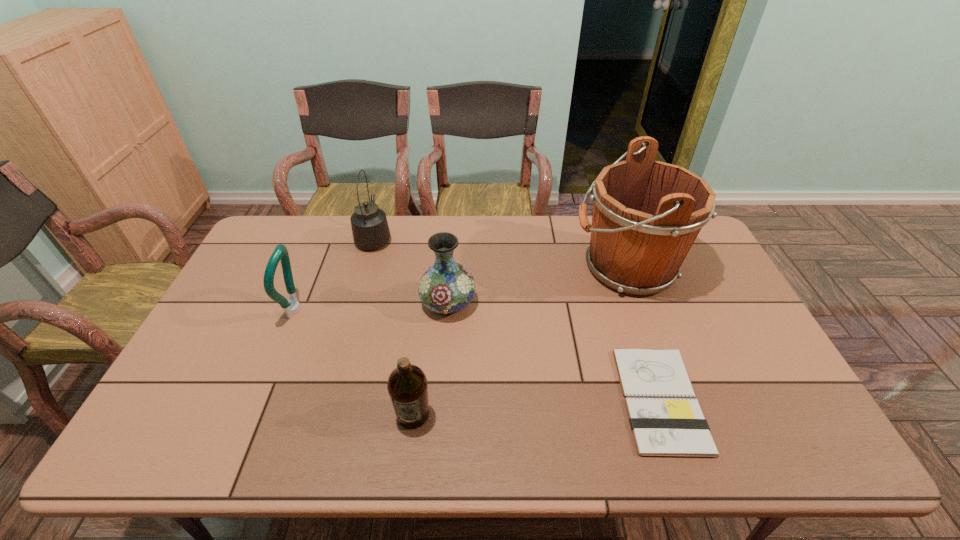
Image resolution: width=960 pixels, height=540 pixels. Find the location of `bucket`. bucket is located at coordinates (647, 214).

Identify the location of the fifth object from right to left. (370, 229).

I want to click on vase, so click(x=446, y=287).

At what (x,y) coordinates should I click in order to perform the action: click on bottle opener. Please return your answer as a coordinate pair (x, y). This screenshot has width=960, height=540. Looking at the image, I should click on click(x=292, y=306).

Find the location of `olive oil`. olive oil is located at coordinates (407, 385).

The height and width of the screenshot is (540, 960). I want to click on the shortest object, so click(x=663, y=423).

Where is `blank area located 0.220m with the handle on the side of the tallest object`? blank area located 0.220m with the handle on the side of the tallest object is located at coordinates (504, 268).

I want to click on blank space located with the handle on the side of the tallest object, so click(x=474, y=268).

Locate an element on the screen. Image resolution: width=960 pixels, height=540 pixels. vacant space located 0.100m with the handle on the side of the tallest object is located at coordinates (540, 268).

Find the location of a particular element. vacant space located on the left of the vase is located at coordinates (397, 303).